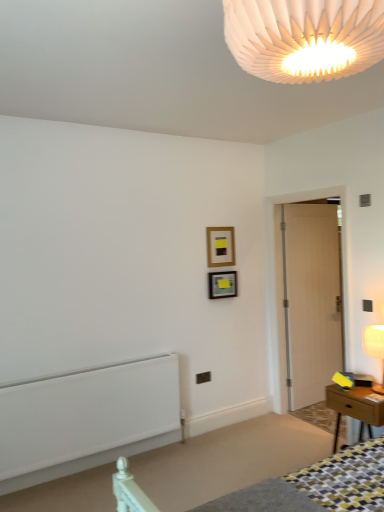
What do you see at coordinates (304, 37) in the screenshot?
I see `white pleated paper lampshade at upper center, the first lamp viewed from the front` at bounding box center [304, 37].

Locate an element on the screen. Image resolution: width=384 pixels, height=512 pixels. matte white lampshade at right, the first lamp when ordered from back to front is located at coordinates (375, 349).

Measure the distance between matte white lampshade at right, the first lamp when ordered from back to front, and camera.

A distance of 2.68 meters exists between matte white lampshade at right, the first lamp when ordered from back to front, and camera.

Describe the element at coordinates (86, 419) in the screenshot. I see `white matte radiator at lower left` at that location.

What are the coordinates of `white matte radiator at lower left` in the screenshot? It's located at (86, 419).

The width and height of the screenshot is (384, 512). What do you see at coordinates (222, 284) in the screenshot?
I see `metallic silver picture frame at upper center, positioned as the 2th picture frame in top-to-bottom order` at bounding box center [222, 284].

Locate an element on the screen. This screenshot has height=512, width=384. light wood door at right is located at coordinates (308, 298).

Which is correct: metallic silver picture frame at upper center, positioned as the 2th picture frame in top-to-bottom order, is inside white matte radiator at lower left, or outside of it?

metallic silver picture frame at upper center, positioned as the 2th picture frame in top-to-bottom order, exists outside the volume of white matte radiator at lower left.

In the scene shown: Is metallic silver picture frame at upper center, arranged as the 1th picture frame when ordered from the bottom, at the left side of white matte radiator at lower left?

No.

In the image, there is a metallic silver picture frame at upper center, positioned as the 2th picture frame in top-to-bottom order. Where is `radiator below it (from the image's perspective)`? The width and height of the screenshot is (384, 512). radiator below it (from the image's perspective) is located at coordinates (86, 419).

Between wooden table at right and white matte radiator at lower left, which one has smaller width?

With smaller width is white matte radiator at lower left.

Locate an element on the screen. radiator that is above the wooden table at right (from a real-world perspective) is located at coordinates (86, 419).

Does wooden table at right come in front of white matte radiator at lower left?

Yes, the depth of wooden table at right is less than that of white matte radiator at lower left.

From the image's perspective, is wooden table at right above white matte radiator at lower left?

Incorrect, from the image's perspective, wooden table at right is lower than white matte radiator at lower left.

Who is bigger, wooden picture frame at upper center, acting as the 1th picture frame starting from the top, or wooden table at right?

wooden table at right.

Would you say wooden picture frame at upper center, acting as the 1th picture frame starting from the top, is inside or outside wooden table at right?

wooden picture frame at upper center, acting as the 1th picture frame starting from the top, is spatially situated outside wooden table at right.

Is wooden picture frame at upper center, the 2th picture frame ordered from the bottom, turned away from wooden table at right?

wooden picture frame at upper center, the 2th picture frame ordered from the bottom, does not have its back to wooden table at right.

Considering the sizes of objects wooden picture frame at upper center, the 2th picture frame ordered from the bottom, and wooden table at right in the image provided, who is wider, wooden picture frame at upper center, the 2th picture frame ordered from the bottom, or wooden table at right?

Wider between the two is wooden table at right.

Considering the relative sizes of wooden picture frame at upper center, acting as the 1th picture frame starting from the top, and matte white lampshade at right, the first lamp when ordered from back to front, in the image provided, is wooden picture frame at upper center, acting as the 1th picture frame starting from the top, smaller than matte white lampshade at right, the first lamp when ordered from back to front,?

Yes.

Based on the photo, can you confirm if wooden picture frame at upper center, acting as the 1th picture frame starting from the top, is taller than matte white lampshade at right, the second lamp when ordered from left to right?

In fact, wooden picture frame at upper center, acting as the 1th picture frame starting from the top, may be shorter than matte white lampshade at right, the second lamp when ordered from left to right.

Can matte white lampshade at right, the first lamp when ordered from back to front, be found inside wooden picture frame at upper center, the 2th picture frame ordered from the bottom?

No.

Does point (223, 253) appear closer or farther from the camera than point (383, 393)?

Clearly, point (223, 253) is more distant from the camera than point (383, 393).

Between light wood door at right and white pleated paper lampshade at upper center, the first lamp in the left-to-right sequence, which one has smaller width?

light wood door at right.

In terms of size, does light wood door at right appear bigger or smaller than white pleated paper lampshade at upper center, the first lamp in the left-to-right sequence?

light wood door at right is bigger than white pleated paper lampshade at upper center, the first lamp in the left-to-right sequence.

Is white pleated paper lampshade at upper center, which appears as the 2th lamp when ordered from the bottom, at the back of light wood door at right?

light wood door at right is not turned away from white pleated paper lampshade at upper center, which appears as the 2th lamp when ordered from the bottom.

Is light wood door at right outside of white pleated paper lampshade at upper center, the first lamp viewed from the front?

Yes, light wood door at right is located beyond the bounds of white pleated paper lampshade at upper center, the first lamp viewed from the front.

Is metallic silver picture frame at upper center, arranged as the 1th picture frame when ordered from the bottom, positioned far away from wooden table at right?

That's right, there is a large distance between metallic silver picture frame at upper center, arranged as the 1th picture frame when ordered from the bottom, and wooden table at right.

From the image's perspective, which object appears higher, metallic silver picture frame at upper center, arranged as the 1th picture frame when ordered from the bottom, or wooden table at right?

metallic silver picture frame at upper center, arranged as the 1th picture frame when ordered from the bottom, from the image's perspective.

Is metallic silver picture frame at upper center, arranged as the 1th picture frame when ordered from the bottom, smaller than wooden table at right?

Yes.

Does wooden table at right have a smaller size compared to white pleated paper lampshade at upper center, marked as the 1th lamp in a top-to-bottom arrangement?

No, wooden table at right is not smaller than white pleated paper lampshade at upper center, marked as the 1th lamp in a top-to-bottom arrangement.

From the image's perspective, is wooden table at right positioned above or below white pleated paper lampshade at upper center, the first lamp in the left-to-right sequence?

wooden table at right is below white pleated paper lampshade at upper center, the first lamp in the left-to-right sequence.

Is wooden table at right not within white pleated paper lampshade at upper center, the second lamp positioned from the right?

Indeed, wooden table at right is completely outside white pleated paper lampshade at upper center, the second lamp positioned from the right.

Visually, is wooden table at right positioned to the left or to the right of white pleated paper lampshade at upper center, the first lamp viewed from the front?

Based on their positions, wooden table at right is located to the right of white pleated paper lampshade at upper center, the first lamp viewed from the front.

The width and height of the screenshot is (384, 512). I want to click on the 1st picture frame above the white matte radiator at lower left (from the image's perspective), so click(x=222, y=284).

Find the location of a particular element. The image size is (384, 512). radiator that appears above the wooden table at right (from a real-world perspective) is located at coordinates (x=86, y=419).

Considering their positions, is metallic silver picture frame at upper center, arranged as the 1th picture frame when ordered from the bottom, positioned further to wooden table at right than white matte radiator at lower left?

The object further to wooden table at right is white matte radiator at lower left.

Based on their spatial positions, is wooden picture frame at upper center, acting as the 1th picture frame starting from the top, or matte white lampshade at right, arranged as the second lamp when viewed from the front, closer to metallic silver picture frame at upper center, arranged as the 1th picture frame when ordered from the bottom?

Based on the image, wooden picture frame at upper center, acting as the 1th picture frame starting from the top, appears to be nearer to metallic silver picture frame at upper center, arranged as the 1th picture frame when ordered from the bottom.

Based on their spatial positions, is matte white lampshade at right, the first lamp when ordered from back to front, or wooden picture frame at upper center, acting as the 1th picture frame starting from the top, closer to wooden table at right?

Among the two, matte white lampshade at right, the first lamp when ordered from back to front, is located nearer to wooden table at right.

Estimate the real-world distances between objects in this image. Which object is closer to wooden table at right, white pleated paper lampshade at upper center, which appears as the 2th lamp when ordered from the bottom, or matte white lampshade at right, which is the first lamp in right-to-left order?

matte white lampshade at right, which is the first lamp in right-to-left order, lies closer to wooden table at right than the other object.

From the image, which object appears to be nearer to matte white lampshade at right, which appears as the first lamp when ordered from the bottom, metallic silver picture frame at upper center, positioned as the 2th picture frame in top-to-bottom order, or wooden table at right?

wooden table at right.

Estimate the real-world distances between objects in this image. Which object is closer to light wood door at right, white pleated paper lampshade at upper center, the first lamp in the left-to-right sequence, or metallic silver picture frame at upper center, positioned as the 2th picture frame in top-to-bottom order?

metallic silver picture frame at upper center, positioned as the 2th picture frame in top-to-bottom order.

Estimate the real-world distances between objects in this image. Which object is closer to light wood door at right, white matte radiator at lower left or white pleated paper lampshade at upper center, marked as the 1th lamp in a top-to-bottom arrangement?

Based on the image, white matte radiator at lower left appears to be nearer to light wood door at right.

Based on their spatial positions, is white pleated paper lampshade at upper center, the first lamp in the left-to-right sequence, or wooden picture frame at upper center, the 2th picture frame ordered from the bottom, further from light wood door at right?

white pleated paper lampshade at upper center, the first lamp in the left-to-right sequence, is positioned further to the anchor light wood door at right.

Find the location of a particular element. lamp between wooden table at right and metallic silver picture frame at upper center, positioned as the 2th picture frame in top-to-bottom order, from front to back is located at coordinates (375, 349).

Locate an element on the screen. This screenshot has width=384, height=512. table between white pleated paper lampshade at upper center, which appears as the 2th lamp when ordered from the bottom, and matte white lampshade at right, the second lamp when ordered from left to right, in the front-back direction is located at coordinates (354, 408).

Find the location of a particular element. The width and height of the screenshot is (384, 512). door situated between white matte radiator at lower left and wooden table at right from left to right is located at coordinates (308, 298).

Where is `lamp that lies between light wood door at right and wooden table at right from top to bottom`? lamp that lies between light wood door at right and wooden table at right from top to bottom is located at coordinates (375, 349).